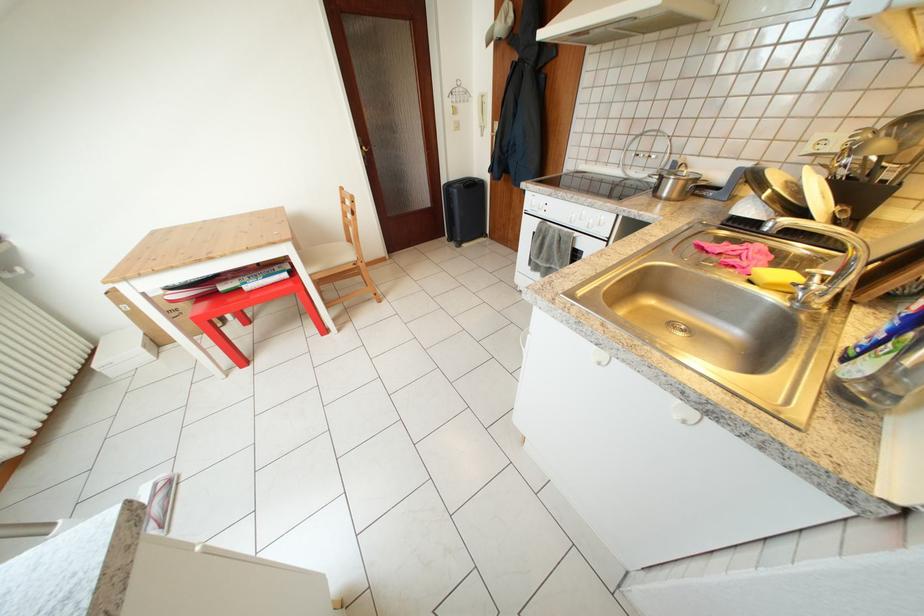
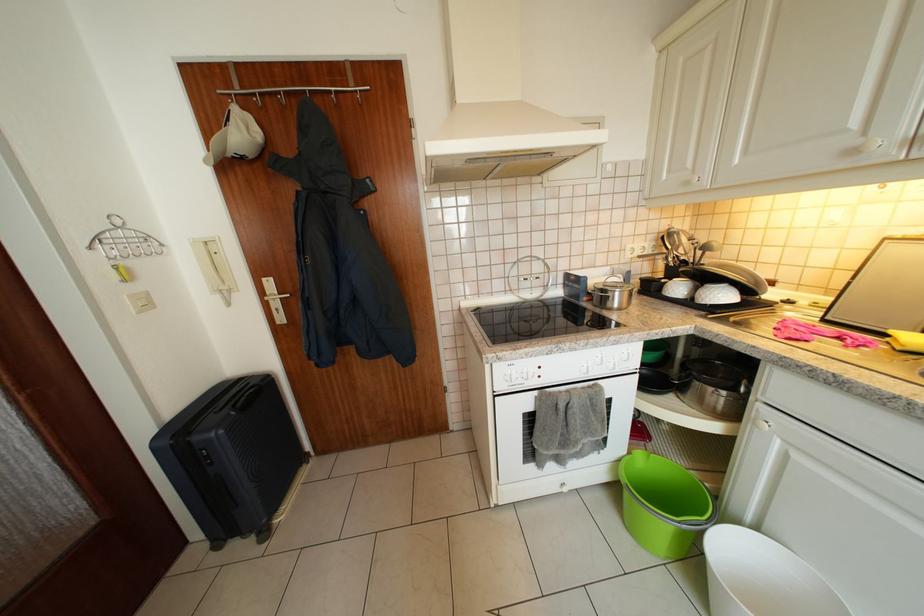
The point at [475,97] is marked in the first image. Where is the corresponding point in the second image?

(156, 243)